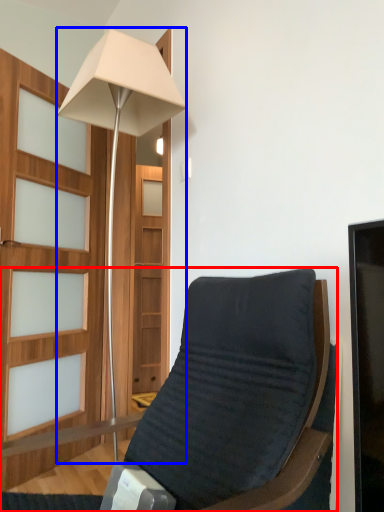
Question: Which of the following is the farthest to the observer, chair (highlighted by a red box) or lamp (highlighted by a blue box)?

Choices:
 (A) chair
 (B) lamp

Answer: (B)